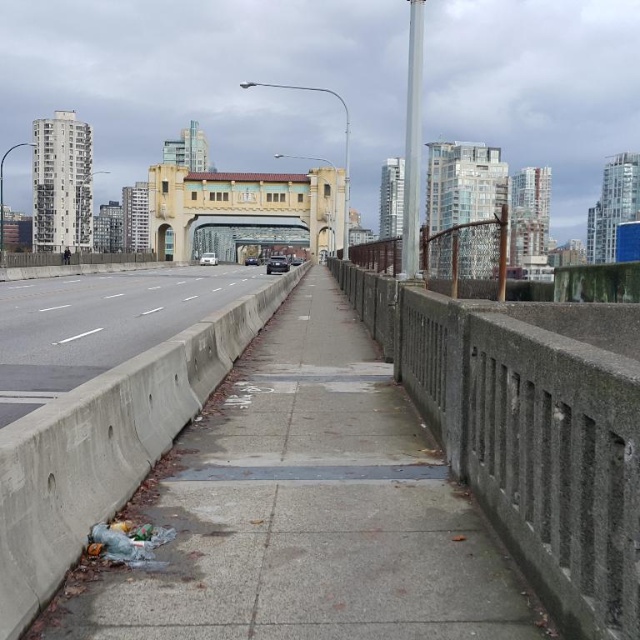
Who is positioned more to the left, concrete at center or golden textured bridge at center?

golden textured bridge at center

Is concrete at center closer to the viewer compared to golden textured bridge at center?

Yes, it is.

Based on the photo, who is more forward, (109,353) or (285,179)?

Positioned in front is point (109,353).

Locate an element on the screen. The image size is (640, 640). concrete at center is located at coordinates (99, 323).

Image resolution: width=640 pixels, height=640 pixels. What do you see at coordinates (305, 512) in the screenshot?
I see `gray concrete pavement at center` at bounding box center [305, 512].

Between gray concrete pavement at center and golden textured bridge at center, which one appears on the right side from the viewer's perspective?

Positioned to the right is gray concrete pavement at center.

The height and width of the screenshot is (640, 640). Find the location of `gray concrete pavement at center`. gray concrete pavement at center is located at coordinates (305, 512).

Identify the location of gray concrete pavement at center. This screenshot has width=640, height=640. (305, 512).

Is gray concrete pavement at center to the right of concrete at center from the viewer's perspective?

Indeed, gray concrete pavement at center is positioned on the right side of concrete at center.

Who is positioned more to the right, gray concrete pavement at center or concrete at center?

gray concrete pavement at center is more to the right.

Who is more forward, (445,564) or (51,285)?

Point (445,564) is in front.

This screenshot has width=640, height=640. I want to click on gray concrete pavement at center, so click(x=305, y=512).